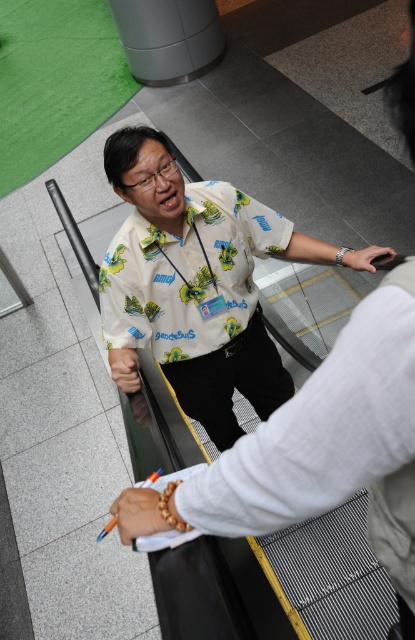
From the picture: Is white printed shirt at center shorter than matte black hand at center?

In fact, white printed shirt at center may be taller than matte black hand at center.

Is white printed shirt at center above matte black hand at center?

Indeed, white printed shirt at center is positioned over matte black hand at center.

Is point (219, 198) positioned before point (127, 374)?

No, (219, 198) is further to viewer.

In order to click on white printed shirt at center in this screenshot , I will do `click(195, 282)`.

Can you confirm if matte black hand at center is positioned to the left of satin black watch at upper center?

Indeed, matte black hand at center is positioned on the left side of satin black watch at upper center.

Is matte black hand at center further to camera compared to satin black watch at upper center?

Yes, it is behind satin black watch at upper center.

Where is `matte black hand at center`? This screenshot has height=640, width=415. matte black hand at center is located at coordinates (124, 369).

Describe the element at coordinates (138, 513) in the screenshot. This screenshot has height=640, width=415. I see `orange beaded bracelet at lower center` at that location.

Does orange beaded bracelet at lower center appear on the left side of satin black watch at upper center?

Indeed, orange beaded bracelet at lower center is positioned on the left side of satin black watch at upper center.

Is point (132, 500) less distant than point (388, 248)?

Yes, point (132, 500) is in front of point (388, 248).

This screenshot has width=415, height=640. I want to click on orange beaded bracelet at lower center, so click(138, 513).